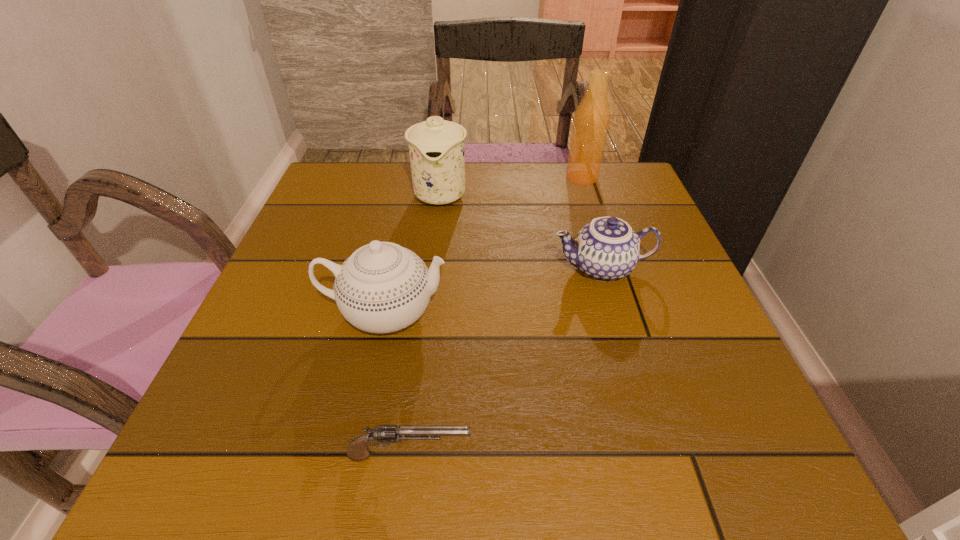
Image resolution: width=960 pixels, height=540 pixels. Identify the location of vacant point located between the shortest chinaware and the shortest object. (506, 361).

Where is `vacant space in between the beer bottle and the second tallest chinaware`? The height and width of the screenshot is (540, 960). vacant space in between the beer bottle and the second tallest chinaware is located at coordinates (484, 245).

Find the location of a particular element. The width and height of the screenshot is (960, 540). vacant area that lies between the fourth shortest object and the tallest object is located at coordinates (511, 186).

At what (x,y) coordinates should I click in order to perform the action: click on object that stands as the second closest to the second tallest object. Please return your answer as a coordinate pair (x, y). This screenshot has width=960, height=540. Looking at the image, I should click on (382, 287).

Locate an element on the screen. The image size is (960, 540). object that is the closest to the fourth shortest object is located at coordinates (606, 249).

The width and height of the screenshot is (960, 540). Find the location of `the closest chinaware to the second tallest chinaware`. the closest chinaware to the second tallest chinaware is located at coordinates (606, 249).

Where is `the third closest chinaware to the beer bottle`? The image size is (960, 540). the third closest chinaware to the beer bottle is located at coordinates (382, 287).